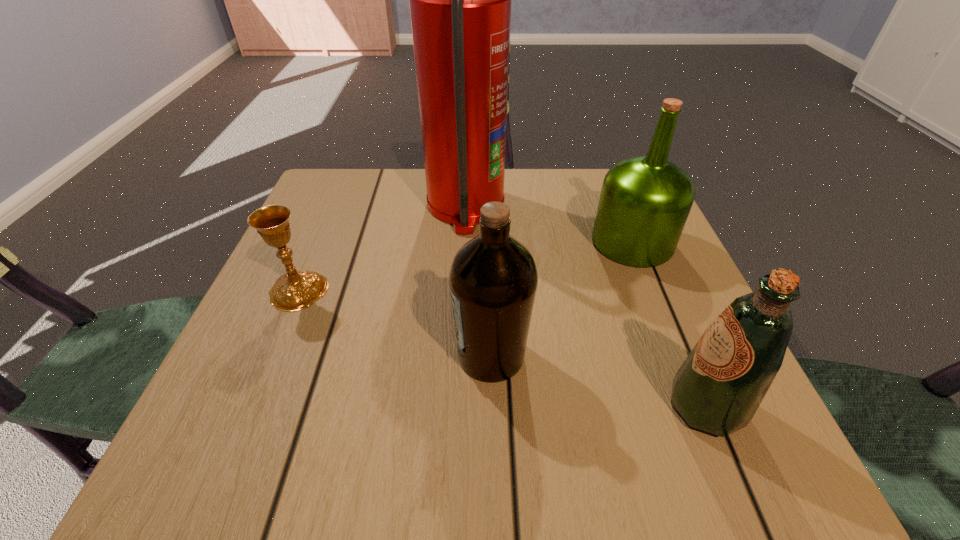
Locate an element on the screen. This screenshot has width=960, height=540. the tallest object is located at coordinates (460, 0).

Locate an element on the screen. The image size is (960, 540). the farthest olive oil is located at coordinates (645, 201).

Image resolution: width=960 pixels, height=540 pixels. In order to click on the leftmost olive oil in this screenshot , I will do `click(493, 278)`.

Identify the location of the third farthest object. (294, 290).

Locate an element on the screen. Image resolution: width=960 pixels, height=540 pixels. chalice is located at coordinates (294, 290).

Find the location of a particular element. The height and width of the screenshot is (540, 960). free space located 0.330m on the instruction side of the fire extinguisher is located at coordinates (650, 206).

Locate an element on the screen. free space located on the front of the farthest olive oil is located at coordinates (688, 379).

The height and width of the screenshot is (540, 960). In order to click on vacant space located on the label of the leftmost olive oil in this screenshot , I will do `click(384, 355)`.

Where is `vacant region located 0.070m on the label of the leftmost olive oil`? vacant region located 0.070m on the label of the leftmost olive oil is located at coordinates (410, 355).

Where is `vacant space situated on the label of the leftmost olive oil`? This screenshot has width=960, height=540. vacant space situated on the label of the leftmost olive oil is located at coordinates (366, 355).